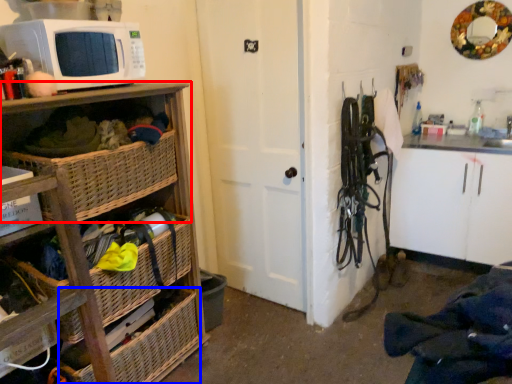
Question: Which of the following is the closest to the observer, shelf (highlighted by a red box) or basket (highlighted by a blue box)?

Choices:
 (A) shelf
 (B) basket

Answer: (A)